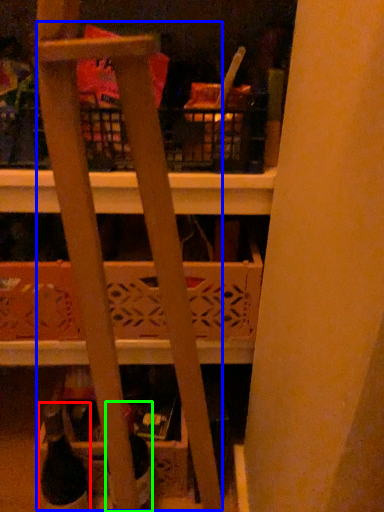
Question: Based on their relative distances, which object is farther from wine bottle (highlighted by a red box)? Choose from ladder (highlighted by a blue box) and bottle (highlighted by a green box).

Choices:
 (A) ladder
 (B) bottle

Answer: (A)